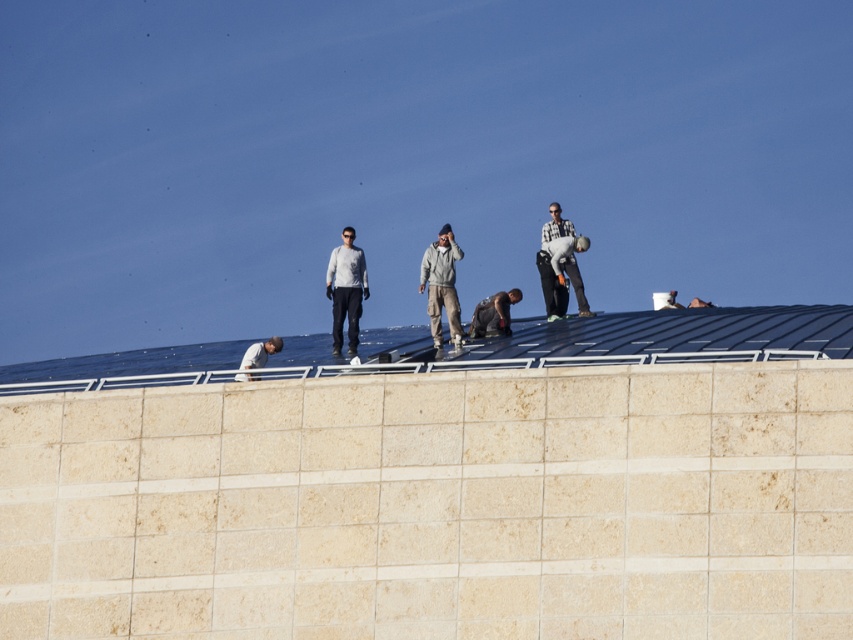
You are a photographer taking a picture of the workers on the rooftop. You notice two people wearing light gray clothing. One is wearing a light gray sweater at center and the other is wearing a light gray fabric shirt at lower left. Which of these two workers is standing closer to the camera?

The light gray sweater at center is much taller than the light gray fabric shirt at lower left, so the light gray sweater at center is closer to the camera.

Consider the image. You are a safety inspector observing the workers on the rooftop. You notice two items worn by the same worker at the center of the image. The items are the light gray sweater at center and the denim pants at center. According to safety regulations, the sweater must be visible above the pants by at least 10 cm to ensure visibility. Can you determine if this requirement is met?

The light gray sweater at center is taller than denim pants at center. Since the sweater is taller, it meets the requirement of being visible above the pants by at least 10 cm.

You are a fashion designer observing the workers on the rooftop. You notice two workers wearing the light gray sweater at center and the dark gray fabric shirt at center. Which clothing item appears to be made from a thinner material?

The light gray sweater at center is thinner than the dark gray fabric shirt at center, so the light gray sweater at center appears to be made from a thinner material.